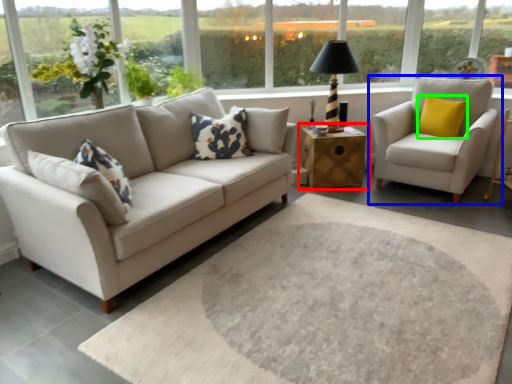
Question: Which is farther away from table (highlighted by a red box)? chair (highlighted by a blue box) or pillow (highlighted by a green box)?

Choices:
 (A) chair
 (B) pillow

Answer: (B)